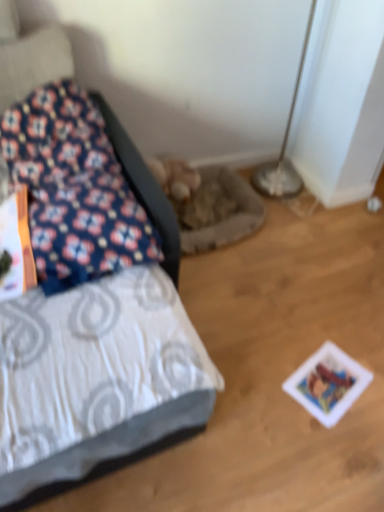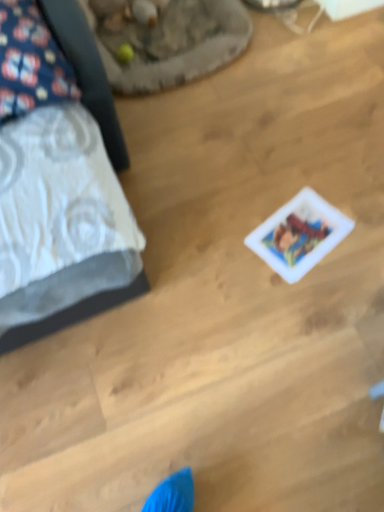
Question: How did the camera likely rotate when shooting the video?

Choices:
 (A) rotated upward
 (B) rotated downward

Answer: (B)